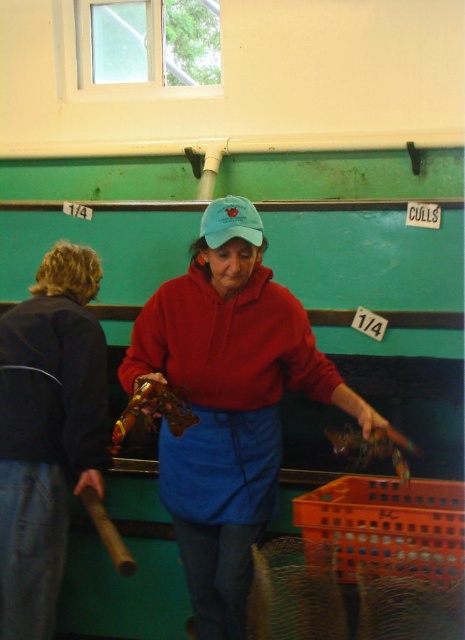
Question: Based on their relative distances, which object is farther from the blue cotton cap at center?

Choices:
 (A) dark blue denim jacket at left
 (B) matte red sweatshirt at center

Answer: (A)

Question: Does dark blue denim jacket at left have a larger size compared to blue cotton cap at center?

Choices:
 (A) yes
 (B) no

Answer: (A)

Question: Estimate the real-world distances between objects in this image. Which object is closer to the blue cotton cap at center?

Choices:
 (A) matte red sweatshirt at center
 (B) dark blue denim jacket at left

Answer: (A)

Question: Which object is closer to the camera taking this photo?

Choices:
 (A) blue cotton cap at center
 (B) matte red sweatshirt at center
 (C) dark blue denim jacket at left

Answer: (A)

Question: Is matte red sweatshirt at center below dark blue denim jacket at left?

Choices:
 (A) no
 (B) yes

Answer: (B)

Question: Can you confirm if dark blue denim jacket at left is positioned below blue cotton cap at center?

Choices:
 (A) no
 (B) yes

Answer: (B)